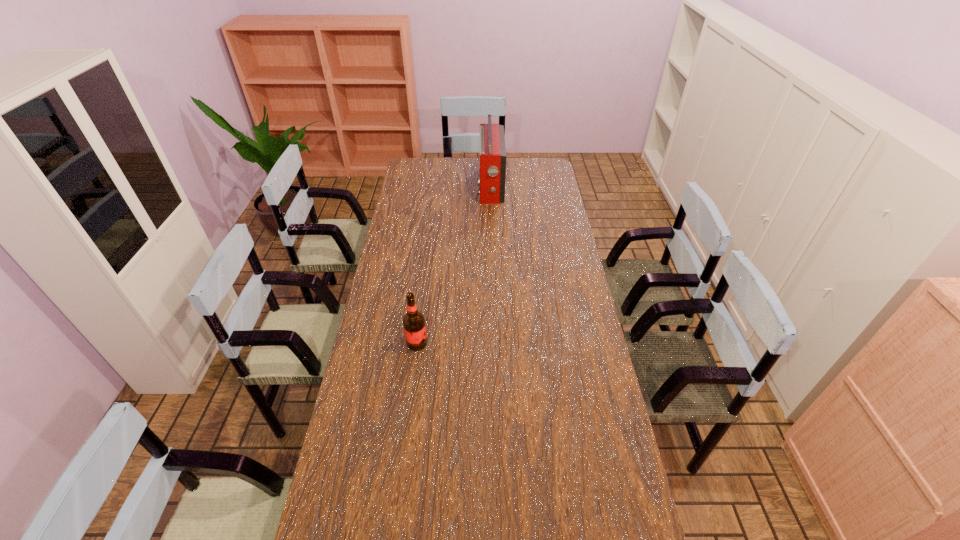
Where is `the farther object`? The image size is (960, 540). the farther object is located at coordinates (492, 139).

I want to click on the taller object, so click(x=492, y=139).

Where is `root beer`? root beer is located at coordinates (414, 325).

Locate an element on the screen. This screenshot has height=540, width=960. the shorter object is located at coordinates (414, 325).

Image resolution: width=960 pixels, height=540 pixels. In order to click on free location located on the front-facing side of the radio receiver in this screenshot , I will do `click(411, 187)`.

You are a GUI agent. You are given a task and a screenshot of the screen. Output one action in this format:
    pyautogui.click(x=<x>, y=<y>)
    Task: Click on the free region located on the front-facing side of the radio receiver
    This screenshot has height=540, width=960.
    Given the screenshot: What is the action you would take?
    pyautogui.click(x=415, y=187)

At what (x,y) coordinates should I click in order to perform the action: click on vacant space located 0.070m on the front-facing side of the radio receiver. Please return your answer as a coordinate pair (x, y). Looking at the image, I should click on tap(464, 187).

You are a GUI agent. You are given a task and a screenshot of the screen. Output one action in this format:
    pyautogui.click(x=<x>, y=<y>)
    Task: Click on the vacant space located 0.270m on the back of the nearer object
    This screenshot has height=540, width=960.
    Given the screenshot: What is the action you would take?
    pyautogui.click(x=425, y=282)

At what (x,y) coordinates should I click in order to perform the action: click on object located at the far edge. Please return your answer as a coordinate pair (x, y). Image resolution: width=960 pixels, height=540 pixels. Looking at the image, I should click on (492, 139).

You are a GUI agent. You are given a task and a screenshot of the screen. Output one action in this format:
    pyautogui.click(x=<x>, y=<y>)
    Task: Click on the object present at the left edge
    
    Given the screenshot: What is the action you would take?
    pyautogui.click(x=414, y=325)